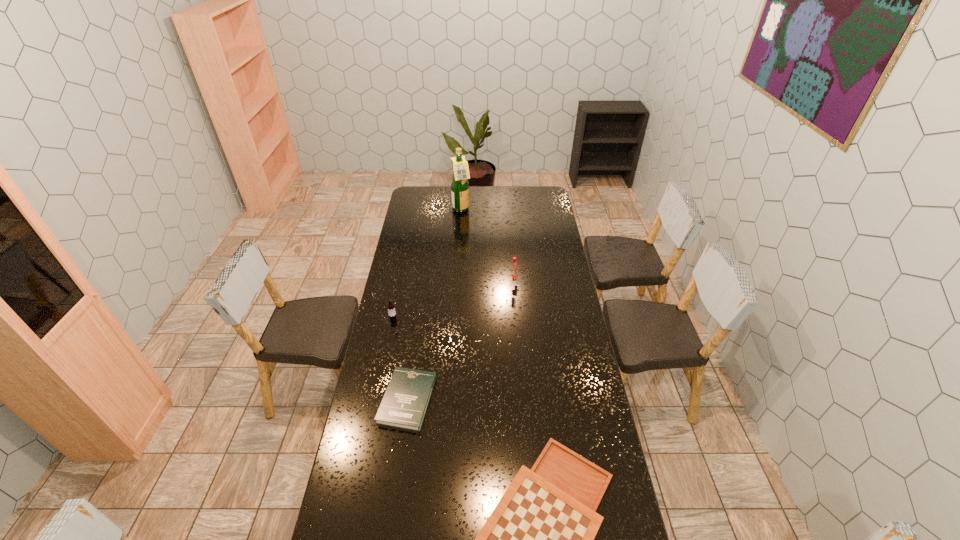
Locate an element on the screen. The height and width of the screenshot is (540, 960). vacant space situated 0.050m on the right of the book is located at coordinates (447, 400).

Identify the location of object at the far edge. Image resolution: width=960 pixels, height=540 pixels. (459, 185).

This screenshot has width=960, height=540. I want to click on root beer that is at the left edge, so click(x=391, y=307).

The image size is (960, 540). Find the location of `book present at the left edge`. book present at the left edge is located at coordinates (405, 402).

This screenshot has width=960, height=540. In the image, there is a desktop. What are the coordinates of `free space at the far edge` in the screenshot? It's located at (507, 186).

At what (x,y) coordinates should I click in order to perform the action: click on vacant space at the left edge. Please return your answer as a coordinate pair (x, y). The width and height of the screenshot is (960, 540). Looking at the image, I should click on (371, 518).

The height and width of the screenshot is (540, 960). I want to click on free spot at the right edge of the desktop, so click(x=555, y=266).

The image size is (960, 540). Identify the location of free spot between the nearer root beer and the right root beer. (453, 301).

This screenshot has width=960, height=540. I want to click on vacant region between the book and the farther root beer, so click(x=461, y=341).

The image size is (960, 540). I want to click on vacant area that lies between the liquor and the second farthest object, so click(488, 246).